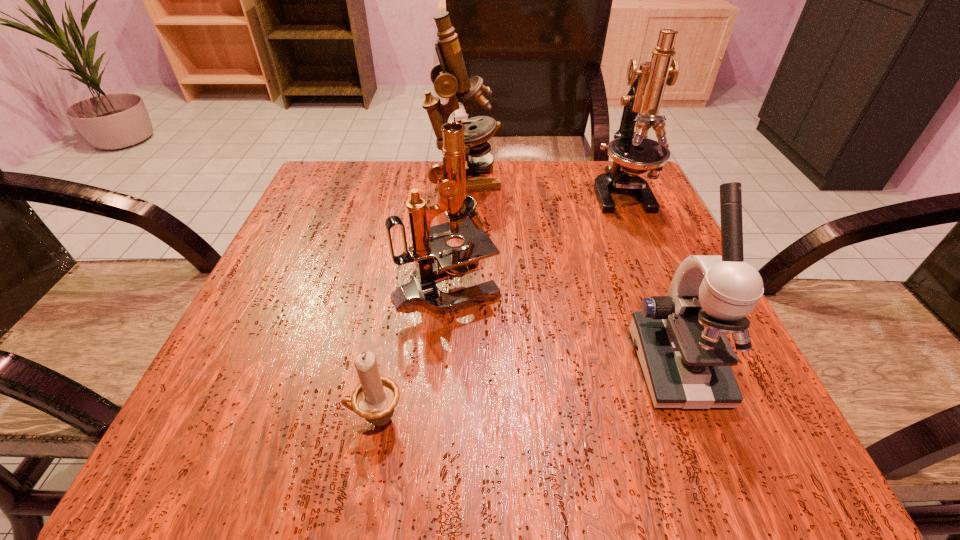
Point out which microscope is positioned as the nearest to the second nearest microscope. Please provide its 2D coordinates. Your answer should be formatted as a tuple, i.e. [(x, y)], where the tuple contains the x and y coordinates of a point satisfying the conditions above.

[(686, 358)]

Identify which microscope is located as the second nearest to the third nearest object. Please provide its 2D coordinates. Your answer should be formatted as a tuple, i.e. [(x, y)], where the tuple contains the x and y coordinates of a point satisfying the conditions above.

[(450, 78)]

Identify the location of vacant area that satisfies the following two spatial constraints: 1. at the eyepiece of the nearest microscope; 2. on the handle side of the shortest object. (697, 419).